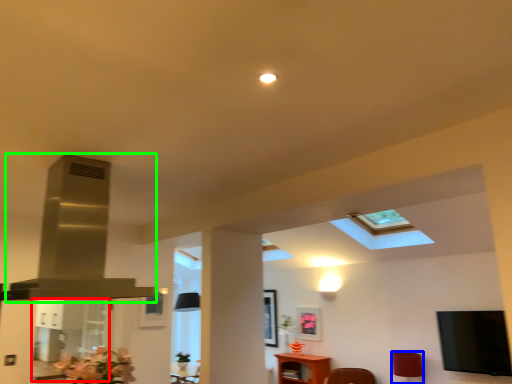
Question: Which object is positioned closest to glass door (highlighted by a red box)? Select from lamp (highlighted by a blue box) and exhaust hood (highlighted by a green box).

Choices:
 (A) lamp
 (B) exhaust hood

Answer: (B)